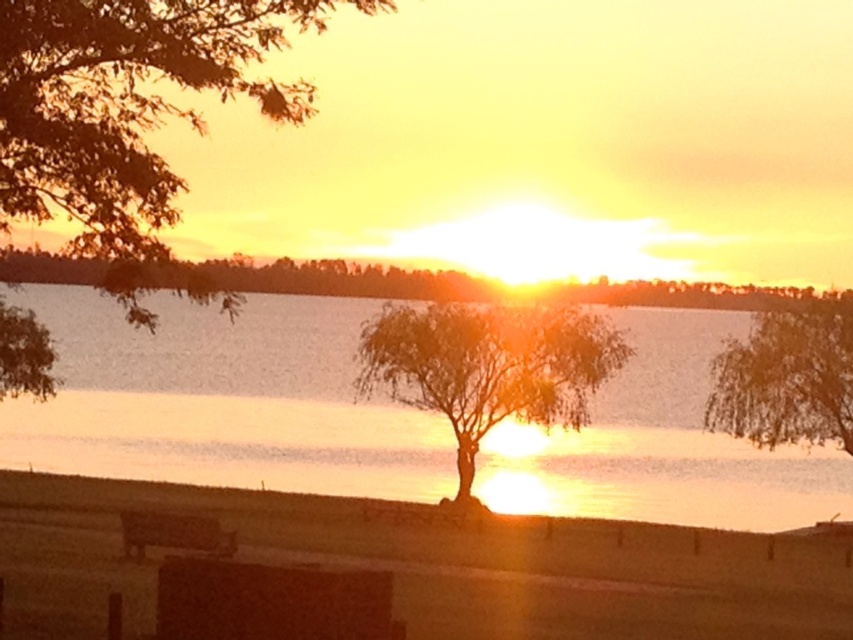
Question: Among these points, which one is nearest to the camera?

Choices:
 (A) (663, 506)
 (B) (155, 256)

Answer: (B)

Question: Can you confirm if translucent glass water at center is positioned to the left of wooden park bench at lower left?

Choices:
 (A) no
 (B) yes

Answer: (A)

Question: Which object appears closest to the camera in this image?

Choices:
 (A) silhouette leafy tree at upper left
 (B) translucent glass water at center
 (C) brown textured tree at center

Answer: (A)

Question: Does brown textured tree at center appear under wooden park bench at lower left?

Choices:
 (A) no
 (B) yes

Answer: (A)

Question: Which object is the farthest from the brown textured tree at center?

Choices:
 (A) green leafy tree at center
 (B) silhouette leafy tree at upper left
 (C) wooden park bench at lower left

Answer: (B)

Question: Does translucent glass water at center lie in front of silhouette leafy tree at upper left?

Choices:
 (A) yes
 (B) no

Answer: (B)